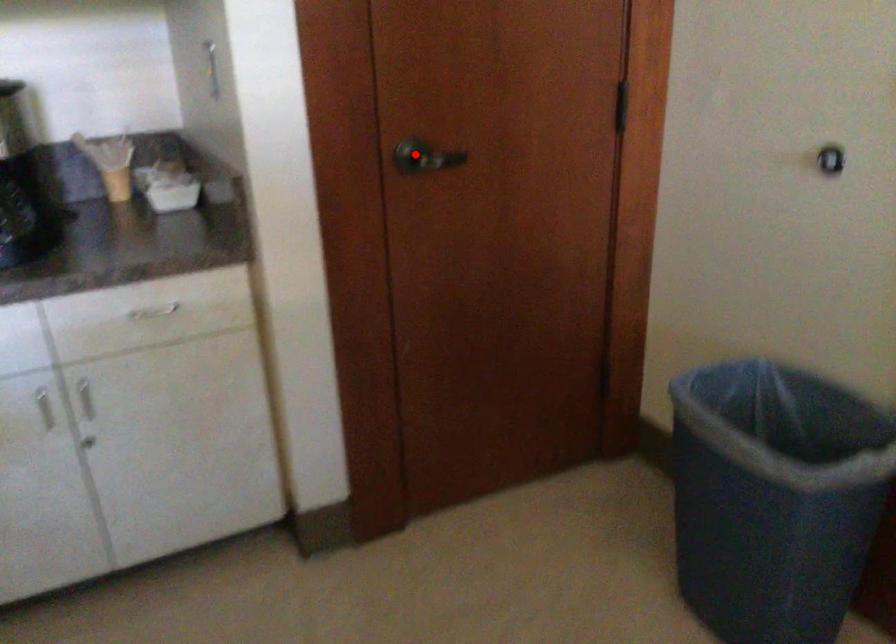
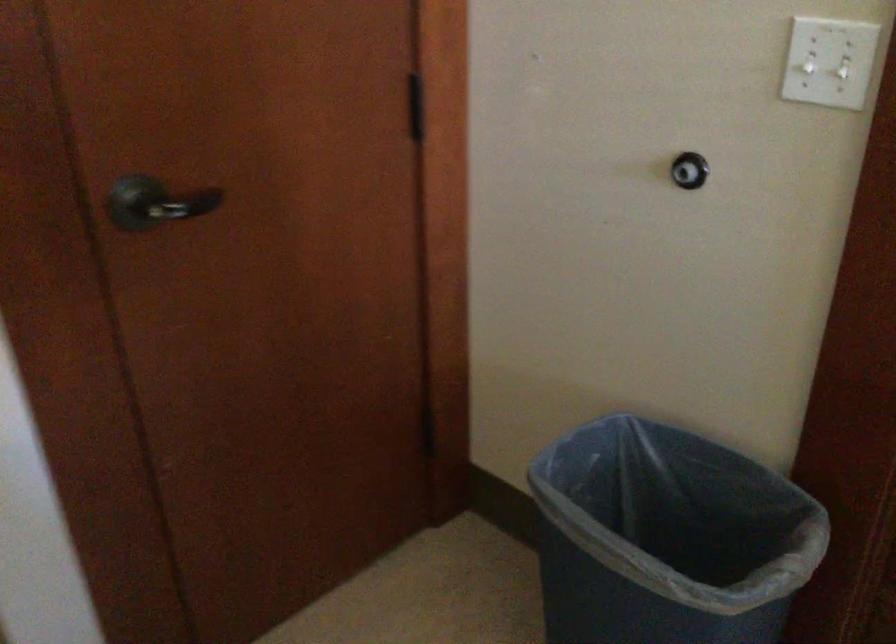
Find the pixel in the second image that matches the highlighted location in the first image.

(156, 203)